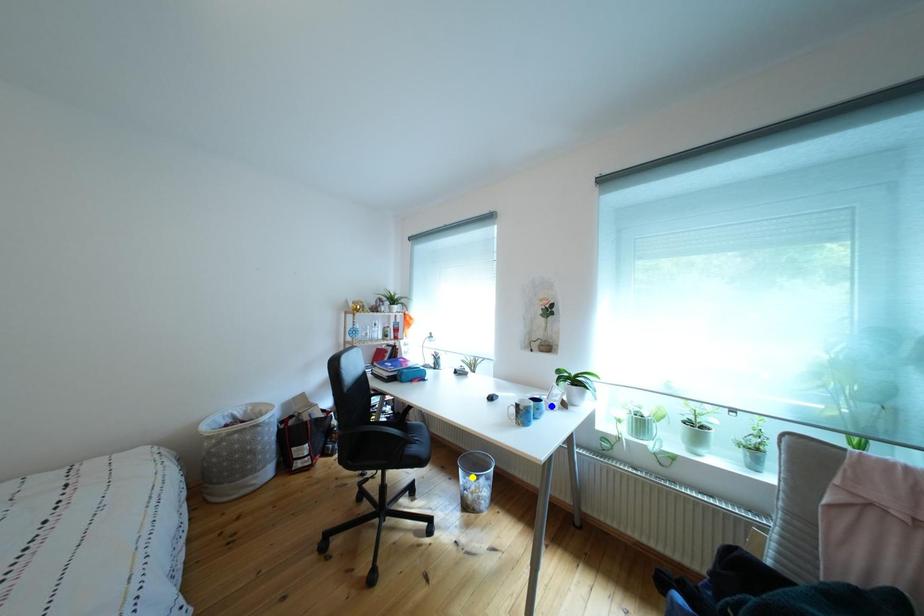
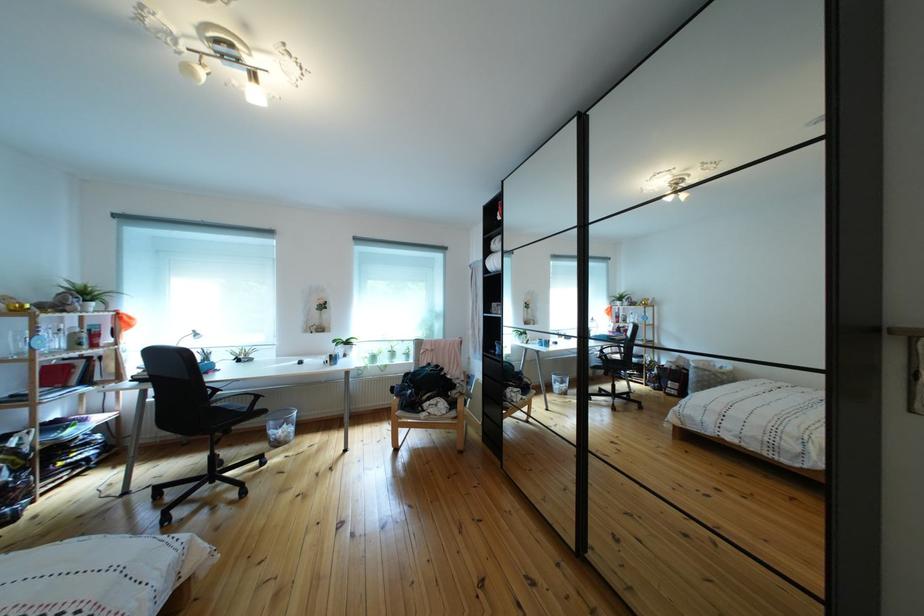
I am providing you with two images of the same scene from different viewpoints. Three points are marked in image1. Which point corresponds to a part or object that is occluded in image2?In image1, three points are marked. Which of them correspond to a part or object that is occluded in image2?Among the three points shown in image1, which one corresponds to a part or object that is no longer visible due to occlusion in image2?

blue point